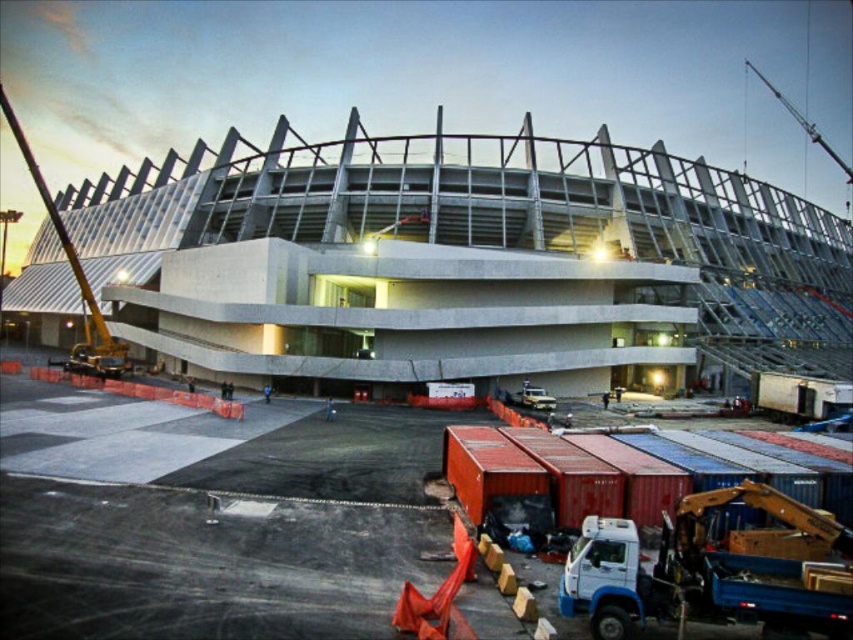
Question: Which of these objects is positioned closest to the metallic yellow crane at lower right?

Choices:
 (A) orange container at center
 (B) metallic yellow crane at left
 (C) concrete stadium at center

Answer: (A)

Question: Which object appears closest to the camera in this image?

Choices:
 (A) concrete stadium at center
 (B) metallic yellow crane at lower right
 (C) metallic yellow crane at left

Answer: (B)

Question: Is concrete stadium at center in front of metallic yellow crane at lower right?

Choices:
 (A) yes
 (B) no

Answer: (B)

Question: Does orange container at center have a smaller size compared to metallic yellow crane at left?

Choices:
 (A) yes
 (B) no

Answer: (A)

Question: Which of the following is the farthest from the observer?

Choices:
 (A) concrete stadium at center
 (B) orange container at center

Answer: (A)

Question: Does metallic yellow crane at lower right appear under metallic yellow crane at left?

Choices:
 (A) yes
 (B) no

Answer: (A)